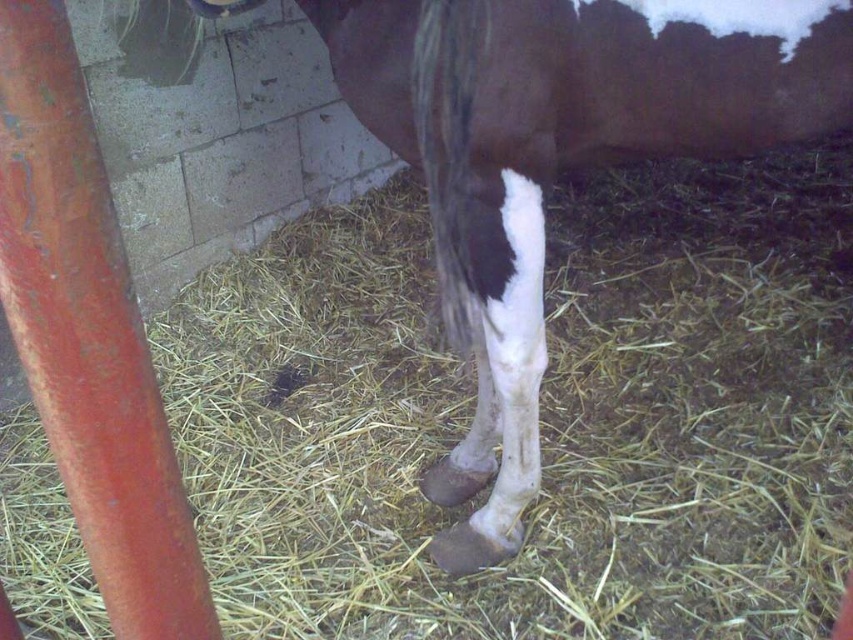
Between brown glossy horse leg at center and brown glossy tail at center, which one has more height?

brown glossy horse leg at center is taller.

Which of these two, brown glossy horse leg at center or brown glossy tail at center, stands shorter?

Standing shorter between the two is brown glossy tail at center.

Is point (440, 298) farther from camera compared to point (454, 173)?

Yes, it is behind point (454, 173).

Identify the location of brown glossy horse leg at center. The height and width of the screenshot is (640, 853). (556, 161).